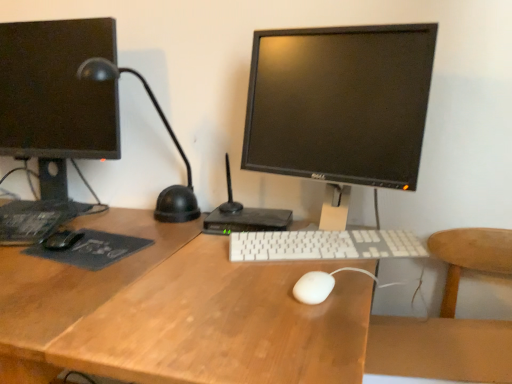
Locate an element on the screen. Image resolution: width=512 pixels, height=384 pixels. vacant area that is in front of white matte mouse at center, which appears as the first mouse when viewed from the front is located at coordinates [297, 330].